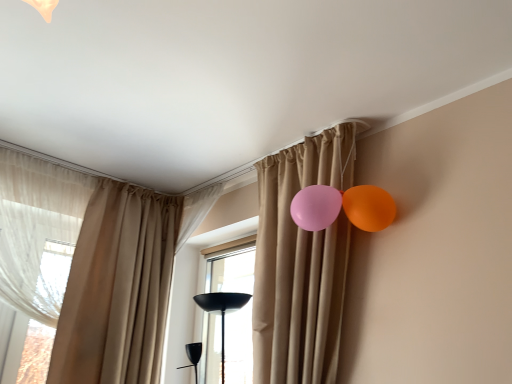
Question: Is transparent glass window at center facing away from sheer white curtain at left, the first curtain in the left-to-right sequence?

Choices:
 (A) yes
 (B) no

Answer: (B)

Question: Is transparent glass window at center to the left of sheer white curtain at left, the 4th curtain viewed from the right, from the viewer's perspective?

Choices:
 (A) yes
 (B) no

Answer: (B)

Question: Is sheer white curtain at left, the first curtain in the left-to-right sequence, inside transparent glass window at center?

Choices:
 (A) no
 (B) yes

Answer: (A)

Question: Can you see transparent glass window at center touching sheer white curtain at left, the first curtain in the left-to-right sequence?

Choices:
 (A) no
 (B) yes

Answer: (A)

Question: Is transparent glass window at center outside sheer white curtain at left, the first curtain in the left-to-right sequence?

Choices:
 (A) yes
 (B) no

Answer: (A)

Question: From the image's perspective, is transparent glass window at center above sheer white curtain at left, the 4th curtain viewed from the right?

Choices:
 (A) no
 (B) yes

Answer: (A)

Question: Could beige fabric curtain at left, which is the 3th curtain in right-to-left order, be considered to be inside beige fabric curtain at center, which ranks as the 3th curtain in left-to-right order?

Choices:
 (A) yes
 (B) no

Answer: (B)

Question: Is beige fabric curtain at center, which is the second curtain from right to left, positioned before beige fabric curtain at left, the 2th curtain positioned from the left?

Choices:
 (A) yes
 (B) no

Answer: (B)

Question: Does beige fabric curtain at center, which is the second curtain from right to left, come behind beige fabric curtain at left, the 2th curtain positioned from the left?

Choices:
 (A) no
 (B) yes

Answer: (B)

Question: Does beige fabric curtain at center, which ranks as the 3th curtain in left-to-right order, have a lesser height compared to beige fabric curtain at left, the 2th curtain positioned from the left?

Choices:
 (A) no
 (B) yes

Answer: (B)

Question: Is the surface of beige fabric curtain at center, which is the second curtain from right to left, in direct contact with beige fabric curtain at left, which is the 3th curtain in right-to-left order?

Choices:
 (A) yes
 (B) no

Answer: (B)

Question: Would you consider beige fabric curtain at center, which ranks as the 3th curtain in left-to-right order, to be distant from beige fabric curtain at left, the 2th curtain positioned from the left?

Choices:
 (A) no
 (B) yes

Answer: (A)

Question: Can you confirm if sheer white curtain at left, the first curtain in the left-to-right sequence, is thinner than transparent glass window at center?

Choices:
 (A) no
 (B) yes

Answer: (A)